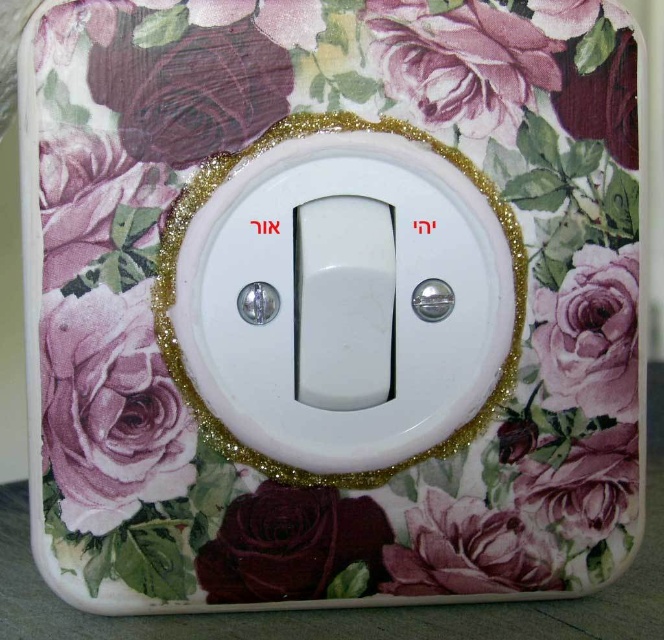
Question: Which object is farther from the camera taking this photo?

Choices:
 (A) matte floral rose at lower left
 (B) white plastic light switch at center
 (C) matte purple rose at upper left
 (D) matte floral rose at upper right

Answer: (D)

Question: Can you confirm if white plastic light switch at center is smaller than matte floral rose at lower left?

Choices:
 (A) yes
 (B) no

Answer: (B)

Question: Which object is the closest to the matte purple rose at upper left?

Choices:
 (A) burgundy glossy rose at lower center
 (B) matte floral rose at upper right

Answer: (A)

Question: Does white plastic light switch at center come behind matte floral rose at upper right?

Choices:
 (A) no
 (B) yes

Answer: (A)

Question: Can you confirm if matte purple rose at upper left is positioned above matte floral rose at upper right?

Choices:
 (A) no
 (B) yes

Answer: (B)

Question: Which object is farther from the camera taking this photo?

Choices:
 (A) matte purple rose at upper left
 (B) matte floral rose at upper right
 (C) matte floral rose at lower left

Answer: (B)